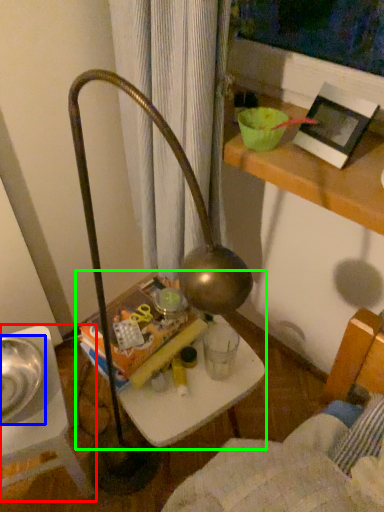
Question: Estimate the real-world distances between objects in this image. Which object is farther from furniture (highlighted by a red box), glass bowl (highlighted by a blue box) or table (highlighted by a green box)?

Choices:
 (A) glass bowl
 (B) table

Answer: (B)